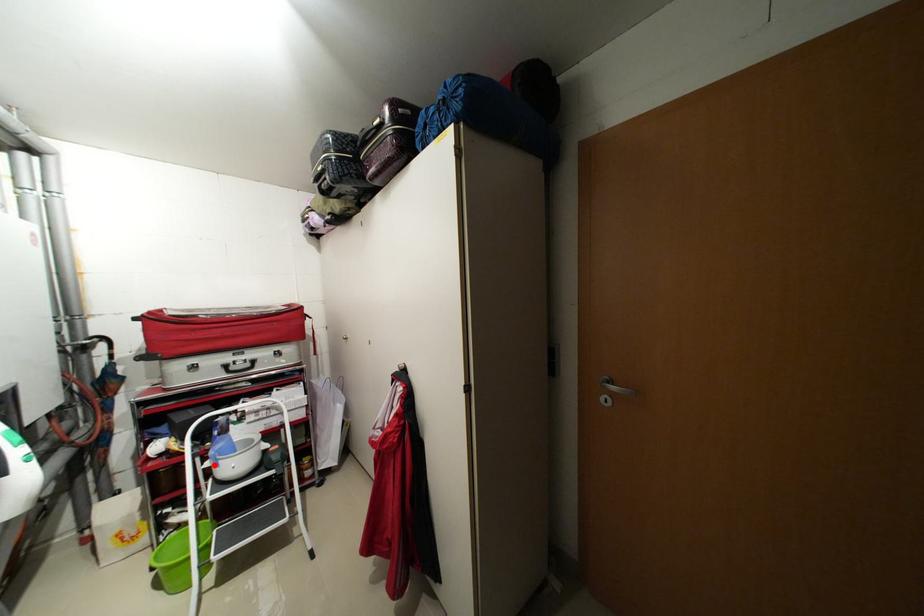
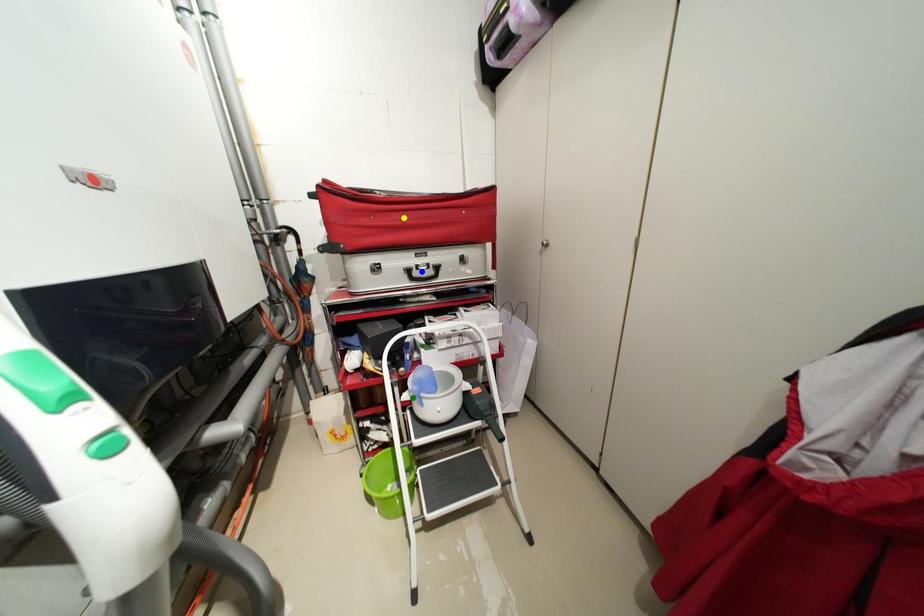
Question: I am providing you with two images of the same scene from different viewpoints. A red point is marked on the first image. You are given multiple points on the second image. Which mark in image 2 goes with the point in image 1?

Choices:
 (A) yellow point
 (B) blue point
 (C) green point

Answer: (C)